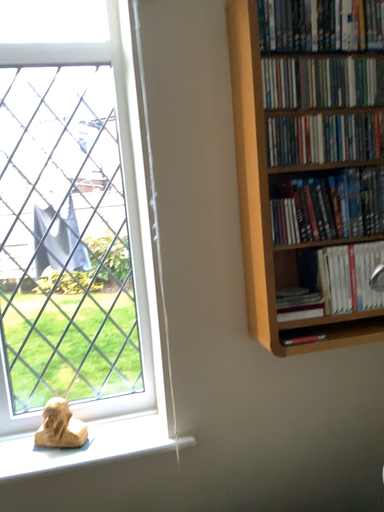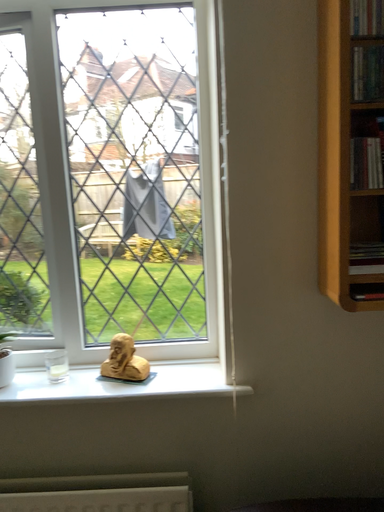
Question: Which way did the camera rotate in the video?

Choices:
 (A) rotated right
 (B) rotated left

Answer: (B)